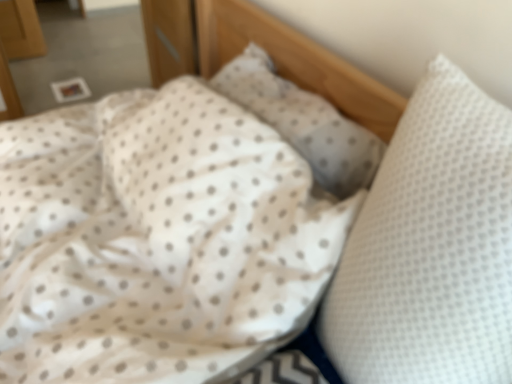
What do you see at coordinates (304, 122) in the screenshot? This screenshot has width=512, height=384. I see `white dotted pillow at center, positioned as the first pillow in back-to-front order` at bounding box center [304, 122].

The width and height of the screenshot is (512, 384). Identify the location of white dotted pillow at center, the second pillow positioned from the front. (304, 122).

Image resolution: width=512 pixels, height=384 pixels. I want to click on white dotted pillow at right, arranged as the first pillow when viewed from the front, so click(x=431, y=247).

Measure the distance between point (475, 180) and camera.

The distance of point (475, 180) from camera is 20.75 inches.

The height and width of the screenshot is (384, 512). Describe the element at coordinates (431, 247) in the screenshot. I see `white dotted pillow at right, arranged as the first pillow when viewed from the front` at that location.

Measure the distance between white dotted pillow at right, positioned as the 2th pillow in back-to-front order, and camera.

They are 19.40 inches apart.

Find the location of a particular element. The height and width of the screenshot is (384, 512). white dotted pillow at center, the second pillow positioned from the front is located at coordinates (304, 122).

Looking at this image, can you confirm if white dotted pillow at right, arranged as the first pillow when viewed from the front, is positioned to the left of white dotted pillow at center, positioned as the first pillow in back-to-front order?

Incorrect, white dotted pillow at right, arranged as the first pillow when viewed from the front, is not on the left side of white dotted pillow at center, positioned as the first pillow in back-to-front order.

Considering their positions, is white dotted pillow at right, arranged as the first pillow when viewed from the front, located in front of or behind white dotted pillow at center, the second pillow positioned from the front?

Visually, white dotted pillow at right, arranged as the first pillow when viewed from the front, is located in front of white dotted pillow at center, the second pillow positioned from the front.

Which is in front, point (411, 236) or point (324, 179)?

The point (411, 236) is more forward.

Looking at this image, from the image's perspective, between white dotted pillow at right, positioned as the 2th pillow in back-to-front order, and white dotted pillow at center, the second pillow positioned from the front, which one is located above?

white dotted pillow at center, the second pillow positioned from the front, appears higher in the image.

From a real-world perspective, is white dotted pillow at right, positioned as the 2th pillow in back-to-front order, on top of white dotted pillow at center, positioned as the first pillow in back-to-front order?

Correct, in the physical world, white dotted pillow at right, positioned as the 2th pillow in back-to-front order, is higher than white dotted pillow at center, positioned as the first pillow in back-to-front order.

Can you confirm if white dotted pillow at right, arranged as the first pillow when viewed from the front, is wider than white dotted pillow at center, the second pillow positioned from the front?

Yes, white dotted pillow at right, arranged as the first pillow when viewed from the front, is wider than white dotted pillow at center, the second pillow positioned from the front.

Is white dotted pillow at right, arranged as the first pillow when viewed from the front, taller or shorter than white dotted pillow at center, positioned as the first pillow in back-to-front order?

In the image, white dotted pillow at right, arranged as the first pillow when viewed from the front, appears to be taller than white dotted pillow at center, positioned as the first pillow in back-to-front order.

Considering the sizes of objects white dotted pillow at right, positioned as the 2th pillow in back-to-front order, and white dotted pillow at center, the second pillow positioned from the front, in the image provided, who is smaller, white dotted pillow at right, positioned as the 2th pillow in back-to-front order, or white dotted pillow at center, the second pillow positioned from the front,?

white dotted pillow at center, the second pillow positioned from the front.

Is white dotted pillow at center, the second pillow positioned from the front, inside white dotted pillow at right, arranged as the first pillow when viewed from the front?

No, white dotted pillow at center, the second pillow positioned from the front, is not a part of white dotted pillow at right, arranged as the first pillow when viewed from the front.

Are white dotted pillow at right, positioned as the 2th pillow in back-to-front order, and white dotted pillow at center, the second pillow positioned from the front, making contact?

No.

Is white dotted pillow at right, arranged as the first pillow when viewed from the front, facing towards white dotted pillow at center, positioned as the first pillow in back-to-front order?

No, white dotted pillow at right, arranged as the first pillow when viewed from the front, is not turned towards white dotted pillow at center, positioned as the first pillow in back-to-front order.

In the scene shown: What's the angular difference between white dotted pillow at right, arranged as the first pillow when viewed from the front, and white dotted pillow at center, the second pillow positioned from the front,'s facing directions?

0.779 degrees separate the facing orientations of white dotted pillow at right, arranged as the first pillow when viewed from the front, and white dotted pillow at center, the second pillow positioned from the front.

Find the location of a particular element. Image resolution: width=512 pixels, height=384 pixels. pillow on the left of white dotted pillow at right, positioned as the 2th pillow in back-to-front order is located at coordinates (304, 122).

Is white dotted pillow at center, positioned as the first pillow in back-to-front order, to the right of white dotted pillow at right, positioned as the 2th pillow in back-to-front order, from the viewer's perspective?

No, white dotted pillow at center, positioned as the first pillow in back-to-front order, is not to the right of white dotted pillow at right, positioned as the 2th pillow in back-to-front order.

Which is in front, white dotted pillow at center, positioned as the first pillow in back-to-front order, or white dotted pillow at right, arranged as the first pillow when viewed from the front?

white dotted pillow at right, arranged as the first pillow when viewed from the front, is more forward.

Is point (270, 69) closer or farther from the camera than point (350, 362)?

Point (270, 69).

From the image's perspective, relative to white dotted pillow at right, arranged as the first pillow when viewed from the front, is white dotted pillow at center, the second pillow positioned from the front, above or below?

From the image's perspective, white dotted pillow at center, the second pillow positioned from the front, appears above white dotted pillow at right, arranged as the first pillow when viewed from the front.

From a real-world perspective, is white dotted pillow at center, the second pillow positioned from the front, above or below white dotted pillow at right, positioned as the 2th pillow in back-to-front order?

In terms of real-world spatial position, white dotted pillow at center, the second pillow positioned from the front, is below white dotted pillow at right, positioned as the 2th pillow in back-to-front order.

Consider the image. Between white dotted pillow at center, positioned as the first pillow in back-to-front order, and white dotted pillow at right, arranged as the first pillow when viewed from the front, which one has larger width?

Wider between the two is white dotted pillow at right, arranged as the first pillow when viewed from the front.

Does white dotted pillow at center, the second pillow positioned from the front, have a lesser height compared to white dotted pillow at right, arranged as the first pillow when viewed from the front?

Indeed, white dotted pillow at center, the second pillow positioned from the front, has a lesser height compared to white dotted pillow at right, arranged as the first pillow when viewed from the front.

Which of these two, white dotted pillow at center, positioned as the first pillow in back-to-front order, or white dotted pillow at right, positioned as the 2th pillow in back-to-front order, is smaller?

white dotted pillow at center, positioned as the first pillow in back-to-front order, is smaller.

Is white dotted pillow at right, positioned as the 2th pillow in back-to-front order, completely or partially inside white dotted pillow at center, positioned as the first pillow in back-to-front order?

No.

Is white dotted pillow at center, the second pillow positioned from the front, far from white dotted pillow at right, positioned as the 2th pillow in back-to-front order?

No.

Consider the image. Could you tell me if white dotted pillow at center, the second pillow positioned from the front, is turned towards white dotted pillow at right, arranged as the first pillow when viewed from the front?

No, white dotted pillow at center, the second pillow positioned from the front, is not turned towards white dotted pillow at right, arranged as the first pillow when viewed from the front.

How distant is white dotted pillow at center, positioned as the first pillow in back-to-front order, from white dotted pillow at right, arranged as the first pillow when viewed from the front?

39.31 centimeters.

Locate an element on the screen. Image resolution: width=512 pixels, height=384 pixels. pillow lying above the white dotted pillow at right, arranged as the first pillow when viewed from the front (from the image's perspective) is located at coordinates (304, 122).

What are the coordinates of `pillow above the white dotted pillow at center, positioned as the first pillow in back-to-front order (from a real-world perspective)` in the screenshot? It's located at (431, 247).

You are a GUI agent. You are given a task and a screenshot of the screen. Output one action in this format:
    pyautogui.click(x=<x>, y=<y>)
    Task: Click on the pillow below the white dotted pillow at center, the second pillow positioned from the front (from the image's perspective)
    
    Given the screenshot: What is the action you would take?
    pyautogui.click(x=431, y=247)